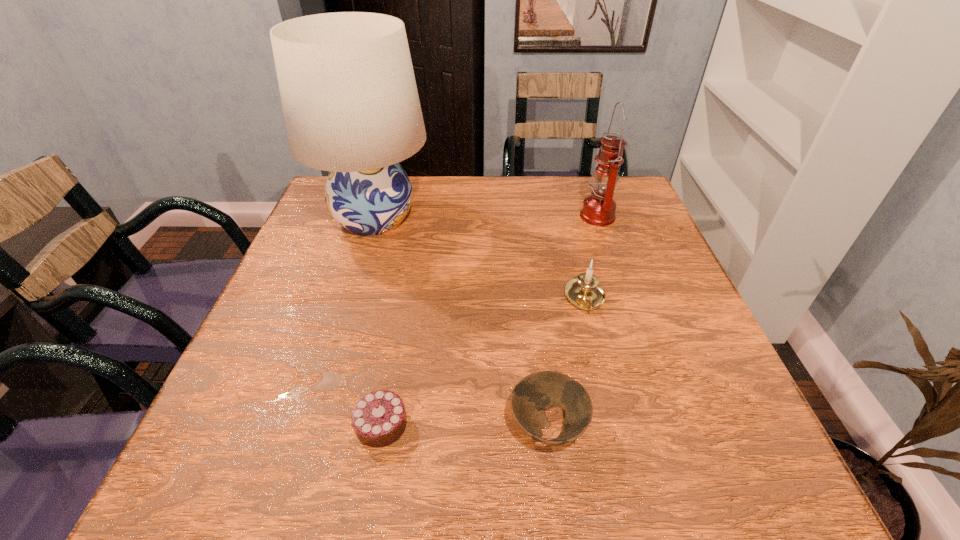
Find the location of `vacant space that satisfies the following two spatial constraints: 1. on the front-facing side of the lampshade; 2. on the back side of the chocolate cake`. vacant space that satisfies the following two spatial constraints: 1. on the front-facing side of the lampshade; 2. on the back side of the chocolate cake is located at coordinates (310, 424).

At what (x,y) coordinates should I click in order to perform the action: click on vacant space that satisfies the following two spatial constraints: 1. on the back side of the fourth shortest object; 2. on the left side of the bowl. Please return your answer as a coordinate pair (x, y). The width and height of the screenshot is (960, 540). Looking at the image, I should click on (521, 216).